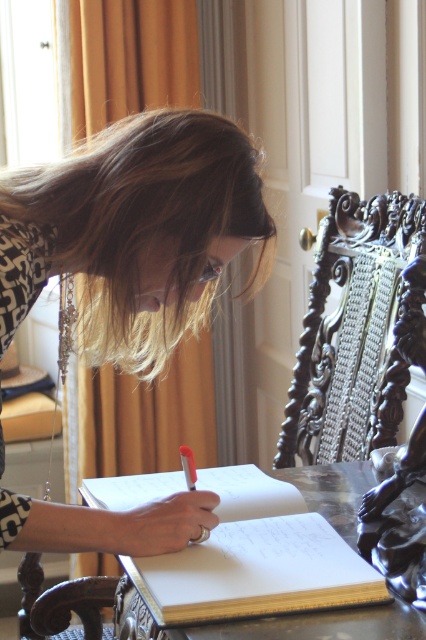
You are a photographer trying to capture the perfect shot of the person writing in their notebook. Based on the scene, where should you position your camera to ensure the blondehair at upper center is centered in the frame?

The blondehair at upper center is located at point 2D coordinates of (146, 227). To center it in the frame, position the camera so the center of the frame aligns with these coordinates.

You are a photographer setting up a shoot in this scene. You need to place a small lamp on the wooden table at center so that it doesn not block the view of the blondehair at upper center. Where should you place the lamp?

The blondehair at upper center is positioned over the wooden table at center, so placing the lamp on the table but away from the area directly under the hair would keep it visible. Position it towards the edge opposite the person or on the side not obscured by their posture.

In the scene shown: You are standing in a room and want to place a small plant on the table where the person is writing. The plant requires at least 4 feet of space from the camera to ensure proper growth. Can the plant be placed at point (126, 364)?

The distance of point (126, 364) from the camera is 5.30 feet, which is more than the required 4 feet. Therefore, the plant can be placed there to meet the growth requirement.